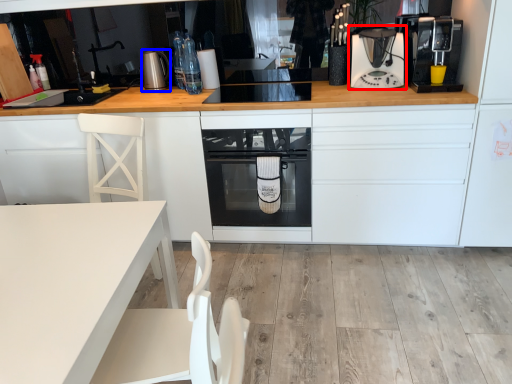
Question: Which point is further to the camera, kitchen appliance (highlighted by a red box) or kitchen appliance (highlighted by a blue box)?

Choices:
 (A) kitchen appliance
 (B) kitchen appliance

Answer: (B)